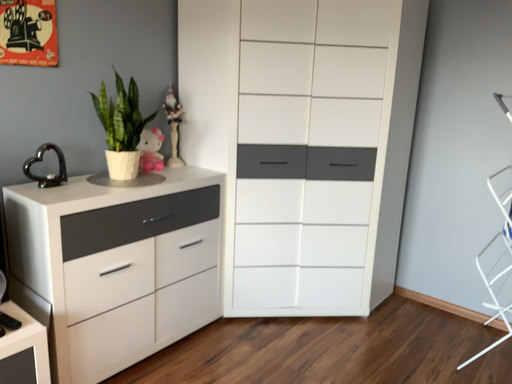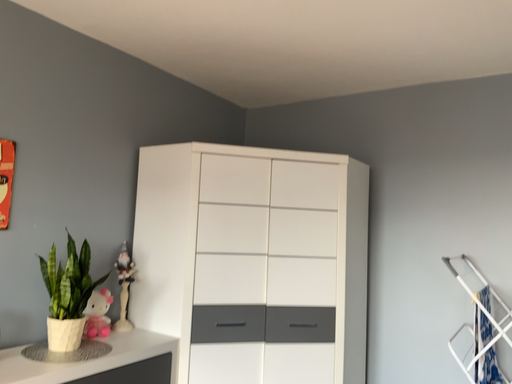
Question: How did the camera likely rotate when shooting the video?

Choices:
 (A) rotated upward
 (B) rotated downward

Answer: (A)